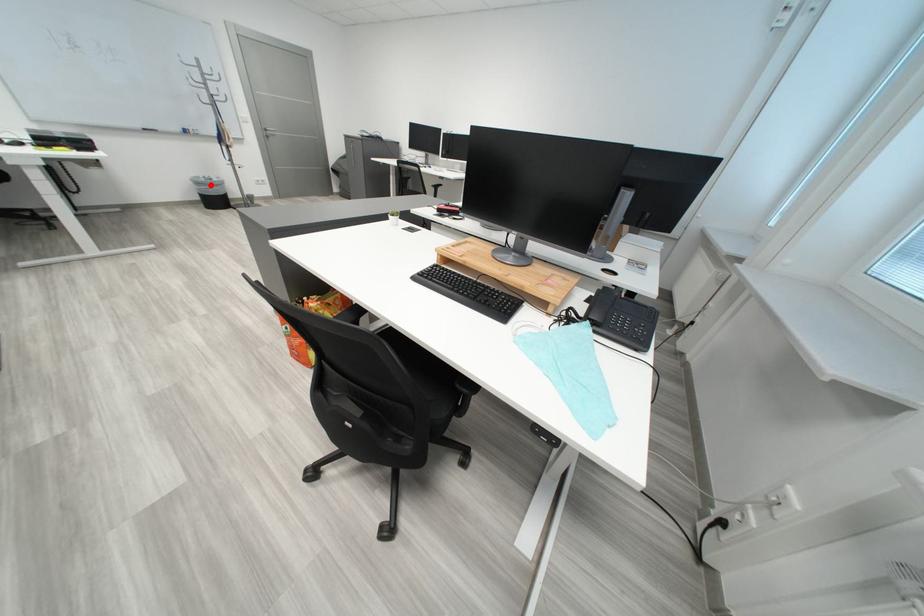
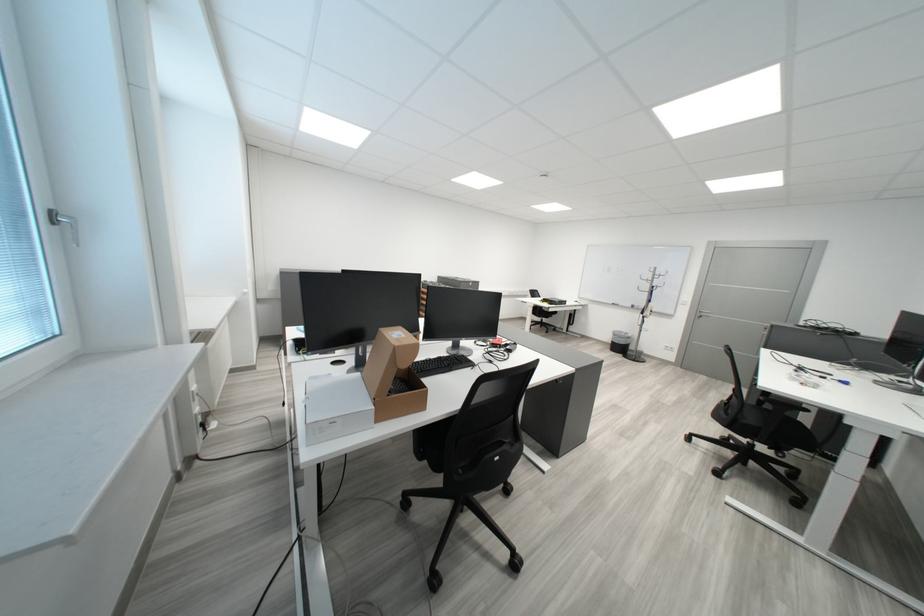
Question: A red point is marked in image1. In image2, is the corresponding 3D point closer to the camera or farther? Reply with the corresponding letter.

Choices:
 (A) The corresponding 3D point is closer.
 (B) The corresponding 3D point is farther.

Answer: (B)